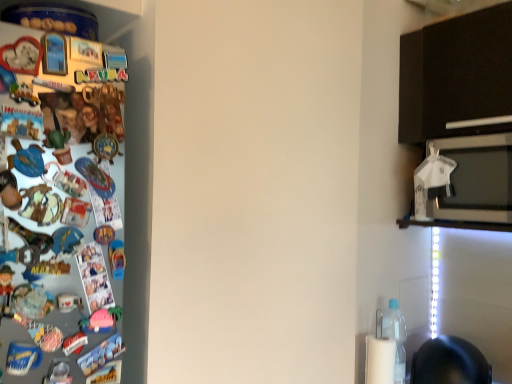
Question: Considering the relative sizes of white glossy microwave oven at upper right and white plastic umbrella at upper right in the image provided, is white glossy microwave oven at upper right shorter than white plastic umbrella at upper right?

Choices:
 (A) no
 (B) yes

Answer: (A)

Question: Is white glossy microwave oven at upper right in contact with white plastic umbrella at upper right?

Choices:
 (A) no
 (B) yes

Answer: (B)

Question: Is the depth of white glossy microwave oven at upper right greater than that of white plastic umbrella at upper right?

Choices:
 (A) yes
 (B) no

Answer: (B)

Question: Considering the relative positions of white glossy microwave oven at upper right and white plastic umbrella at upper right in the image provided, is white glossy microwave oven at upper right in front of white plastic umbrella at upper right?

Choices:
 (A) yes
 (B) no

Answer: (A)

Question: Is white glossy microwave oven at upper right taller than white plastic umbrella at upper right?

Choices:
 (A) no
 (B) yes

Answer: (B)

Question: Is white plastic umbrella at upper right wider or thinner than clear plastic bottle at lower right?

Choices:
 (A) thin
 (B) wide

Answer: (A)

Question: Is white plastic umbrella at upper right spatially inside clear plastic bottle at lower right, or outside of it?

Choices:
 (A) outside
 (B) inside

Answer: (A)

Question: From a real-world perspective, is white plastic umbrella at upper right above or below clear plastic bottle at lower right?

Choices:
 (A) below
 (B) above

Answer: (B)

Question: From the image's perspective, is white plastic umbrella at upper right located above or below clear plastic bottle at lower right?

Choices:
 (A) above
 (B) below

Answer: (A)

Question: Is point (419, 178) positioned closer to the camera than point (434, 205)?

Choices:
 (A) closer
 (B) farther

Answer: (B)

Question: Based on their sizes in the image, would you say white plastic umbrella at upper right is bigger or smaller than white glossy microwave oven at upper right?

Choices:
 (A) small
 (B) big

Answer: (A)

Question: Is white plastic umbrella at upper right in front of or behind white glossy microwave oven at upper right in the image?

Choices:
 (A) behind
 (B) front

Answer: (A)

Question: Is white plastic umbrella at upper right inside or outside of white glossy microwave oven at upper right?

Choices:
 (A) inside
 (B) outside

Answer: (A)

Question: Looking at the image, does clear plastic bottle at lower right seem bigger or smaller compared to white glossy microwave oven at upper right?

Choices:
 (A) small
 (B) big

Answer: (A)

Question: In terms of height, does clear plastic bottle at lower right look taller or shorter compared to white glossy microwave oven at upper right?

Choices:
 (A) tall
 (B) short

Answer: (A)